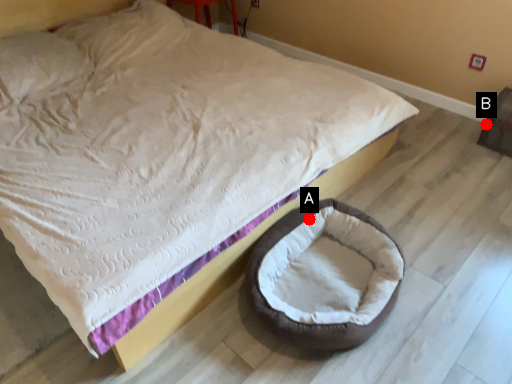
Question: Two points are circled on the image, labeled by A and B beside each circle. Which point is further to the camera?

Choices:
 (A) A is further
 (B) B is further

Answer: (B)